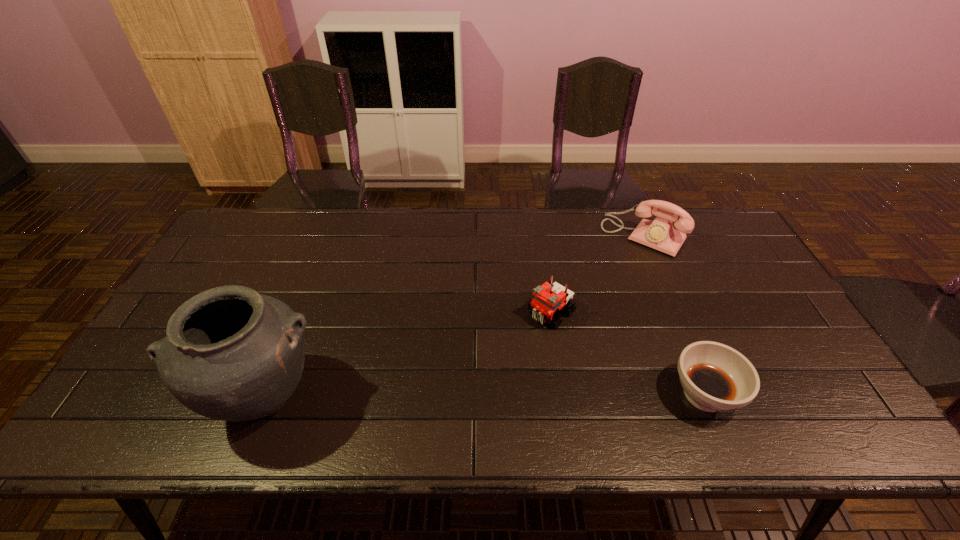
Identify the location of the tallest object. pyautogui.click(x=231, y=354).

Locate an element on the screen. This screenshot has width=960, height=540. the leftmost object is located at coordinates (231, 354).

Find the location of a particular element. This screenshot has height=540, width=960. soup bowl is located at coordinates (715, 377).

At what (x,y) coordinates should I click in order to perform the action: click on the third nearest object. Please return your answer as a coordinate pair (x, y). This screenshot has height=540, width=960. Looking at the image, I should click on (548, 298).

Locate an element on the screen. The image size is (960, 540). the third tallest object is located at coordinates (548, 298).

Where is `the farthest object`? the farthest object is located at coordinates point(660,234).

At what (x,y) coordinates should I click in order to perform the action: click on telephone. Please return your answer as a coordinate pair (x, y). Looking at the image, I should click on (660, 234).

Locate an element on the screen. The width and height of the screenshot is (960, 540). free region located on the back of the leftmost object is located at coordinates (304, 296).

In order to click on vacant space situated 0.320m on the left of the shortest object in this screenshot , I will do `click(535, 395)`.

At what (x,y) coordinates should I click in order to perform the action: click on free space located on the front-facing side of the third tallest object. Please return your answer as a coordinate pair (x, y). This screenshot has width=960, height=540. Looking at the image, I should click on (525, 336).